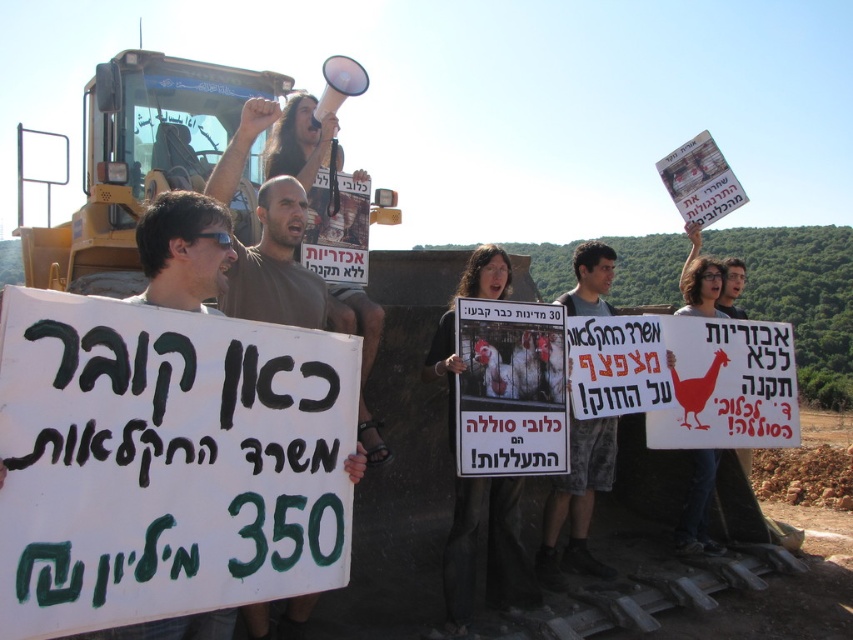
Question: Among these objects, which one is farthest from the camera?

Choices:
 (A) black fabric shirt at center
 (B) white paper sign at center
 (C) white paper sign at upper right
 (D) camouflage shorts at center

Answer: (C)

Question: Which point appears farthest from the camera in this image?

Choices:
 (A) (447, 349)
 (B) (575, 512)
 (C) (196, 221)

Answer: (B)

Question: Is black fabric shirt at center wider than camouflage shorts at center?

Choices:
 (A) yes
 (B) no

Answer: (A)

Question: Which object is the closest to the black fabric shirt at center?

Choices:
 (A) white paper sign at upper right
 (B) white paper sign at center
 (C) camouflage shorts at center

Answer: (C)

Question: Is black fabric shirt at center to the left of white paper sign at upper right from the viewer's perspective?

Choices:
 (A) no
 (B) yes

Answer: (B)

Question: Does white paper sign at center lie behind camouflage shorts at center?

Choices:
 (A) yes
 (B) no

Answer: (B)